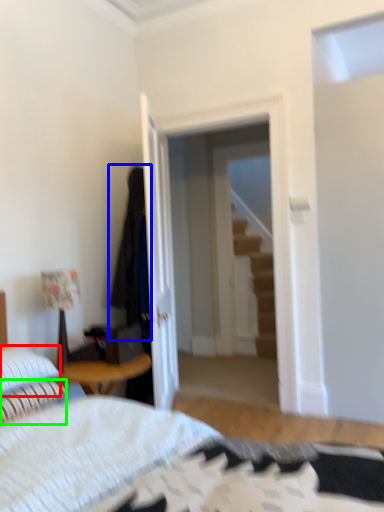
Question: Which is farther away from pillow (highlighted by a red box)? robe (highlighted by a blue box) or pillow (highlighted by a green box)?

Choices:
 (A) robe
 (B) pillow

Answer: (A)